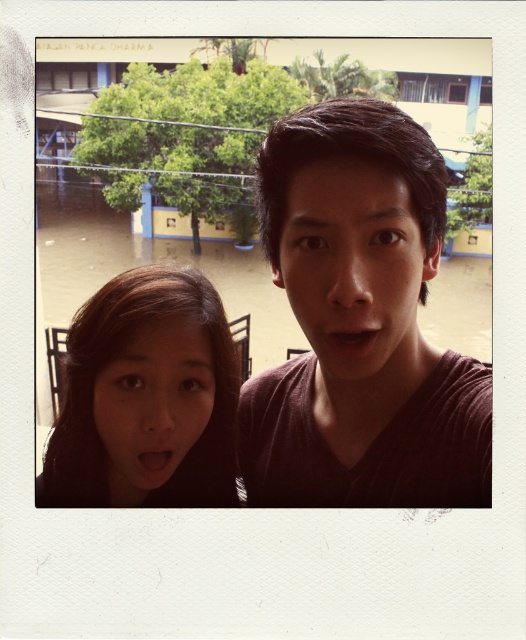
You are an observer looking at the Polaroid photo. You notice the brown hair at lower left and the matte brown face at center. Which object is positioned lower in the image?

The brown hair at lower left is positioned lower than the matte brown face at center.

You are designing a poster and need to know which object in the image is wider for layout purposes. The objects are the dark brown matte shirt at upper right and the matte skin face at center. Which one has a greater width?

The dark brown matte shirt at upper right has a greater width than the matte skin face at center according to the description.

In the vintage Polaroid photo, there are two people in the foreground. The woman on the left has a dark brown matte shirt at upper right, and the man on the right has a matte brown face at center. Which of these two items appears taller in the image?

The dark brown matte shirt at upper right is taller than the matte brown face at center in the image.